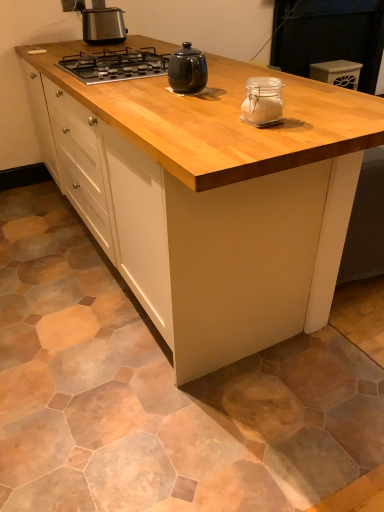
Identify the location of vacant area that lies to the right of clear glass jar at center, positioned as the 3th kitchen appliance in left-to-right order. (326, 119).